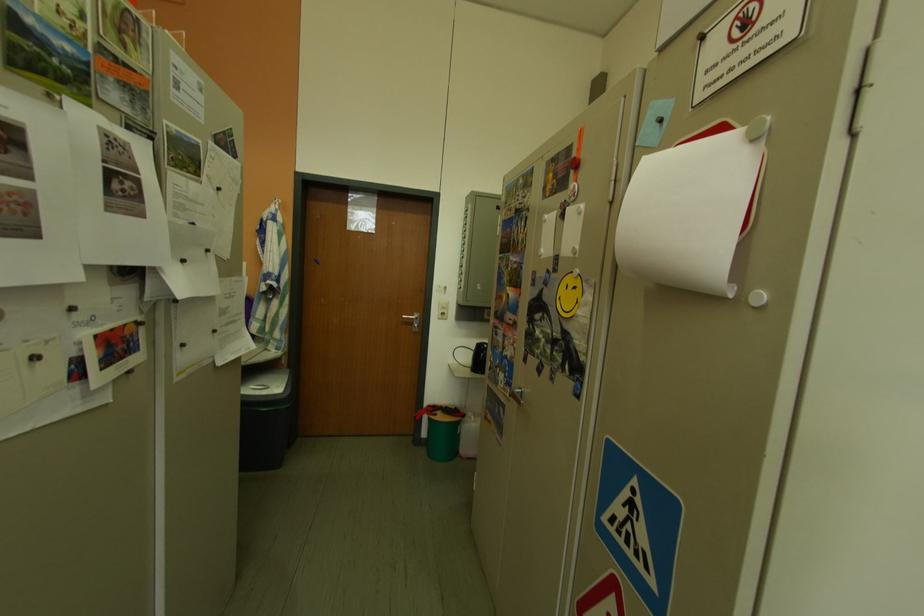
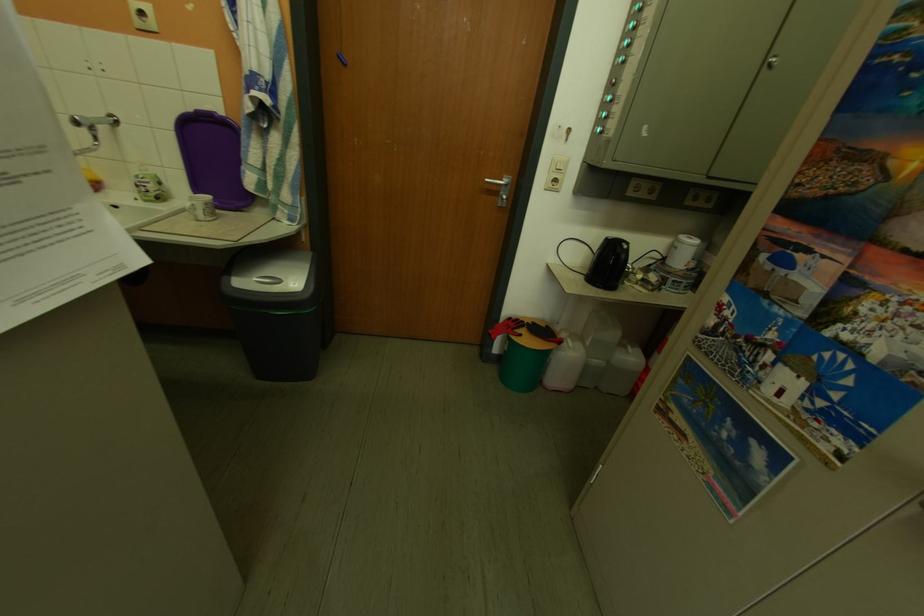
Locate, in the second image, the point that corresponds to (448,416) in the first image.

(533, 338)